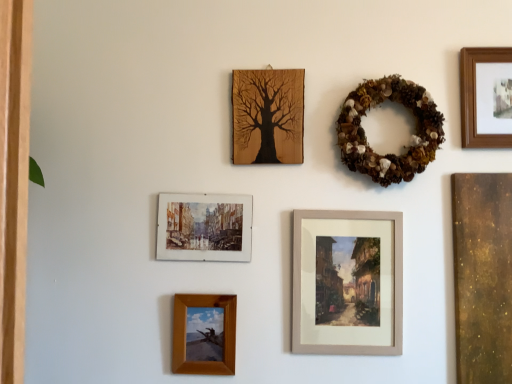
Question: From the image's perspective, is watercolor paper painting at upper left, the 2th picture frame when ordered from left to right, located beneath wooden frame at lower center, which is the first picture frame in left-to-right order?

Choices:
 (A) yes
 (B) no

Answer: (B)

Question: Would you say watercolor paper painting at upper left, arranged as the fourth picture frame when viewed from the right, is outside wooden frame at lower center, which appears as the 5th picture frame when viewed from the right?

Choices:
 (A) no
 (B) yes

Answer: (B)

Question: Does watercolor paper painting at upper left, the 2th picture frame when ordered from left to right, come behind wooden frame at lower center, which appears as the 5th picture frame when viewed from the right?

Choices:
 (A) no
 (B) yes

Answer: (B)

Question: Does watercolor paper painting at upper left, arranged as the fourth picture frame when viewed from the right, have a lesser width compared to wooden frame at lower center, which appears as the 5th picture frame when viewed from the right?

Choices:
 (A) no
 (B) yes

Answer: (B)

Question: From a real-world perspective, is watercolor paper painting at upper left, the 2th picture frame when ordered from left to right, on wooden frame at lower center, which is the first picture frame in left-to-right order?

Choices:
 (A) no
 (B) yes

Answer: (B)

Question: From the image's perspective, is watercolor paper painting at upper left, arranged as the fourth picture frame when viewed from the right, above or below wooden frame at upper right, which is the 5th picture frame in left-to-right order?

Choices:
 (A) above
 (B) below

Answer: (B)

Question: Considering the relative positions of watercolor paper painting at upper left, arranged as the fourth picture frame when viewed from the right, and wooden frame at upper right, which is the 5th picture frame in left-to-right order, in the image provided, is watercolor paper painting at upper left, arranged as the fourth picture frame when viewed from the right, to the left or to the right of wooden frame at upper right, which is the 5th picture frame in left-to-right order,?

Choices:
 (A) right
 (B) left

Answer: (B)

Question: Based on their sizes in the image, would you say watercolor paper painting at upper left, the 2th picture frame when ordered from left to right, is bigger or smaller than wooden frame at upper right, the 1th picture frame viewed from the right?

Choices:
 (A) small
 (B) big

Answer: (A)

Question: From a real-world perspective, is watercolor paper painting at upper left, the 2th picture frame when ordered from left to right, positioned above or below wooden frame at upper right, the 1th picture frame viewed from the right?

Choices:
 (A) above
 (B) below

Answer: (B)

Question: Relative to wooden frame at lower center, which appears as the 5th picture frame when viewed from the right, is wooden frame at upper right, which is the 5th picture frame in left-to-right order, in front or behind?

Choices:
 (A) front
 (B) behind

Answer: (B)

Question: In terms of height, does wooden frame at upper right, which is the 5th picture frame in left-to-right order, look taller or shorter compared to wooden frame at lower center, which appears as the 5th picture frame when viewed from the right?

Choices:
 (A) short
 (B) tall

Answer: (B)

Question: Does point (480, 114) appear closer or farther from the camera than point (176, 336)?

Choices:
 (A) closer
 (B) farther

Answer: (B)

Question: Looking at their shapes, would you say wooden frame at upper right, which is the 5th picture frame in left-to-right order, is wider or thinner than wooden frame at lower center, which appears as the 5th picture frame when viewed from the right?

Choices:
 (A) wide
 (B) thin

Answer: (A)

Question: Is watercolor paper painting at upper left, the 2th picture frame when ordered from left to right, bigger or smaller than wooden framed painting at center, the fourth picture frame in the left-to-right sequence?

Choices:
 (A) big
 (B) small

Answer: (B)

Question: Does point (180, 236) appear closer or farther from the camera than point (345, 218)?

Choices:
 (A) closer
 (B) farther

Answer: (B)